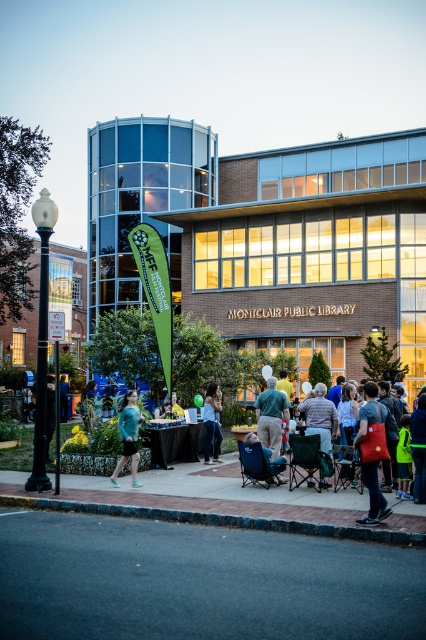
You are organizing a community event at the Monclair Public Library and need to place a decorative item on the table. Which object should you avoid placing on the black tablecloth at center to ensure it doesn not block the view of the blue fabric chair at center?

Since the black tablecloth at center is to the left of the blue fabric chair at center, placing a decorative item on the left side of the black tablecloth at center could block the view of the blue fabric chair at center. Therefore, avoid placing the decorative item on the left side of the black tablecloth at center.

You are attending an event at the Monclair Public Library and notice a teal fabric shirt at center and a blue fabric chair at center. From the perspective of someone standing at the entrance of the library, which object is located to the left?

The teal fabric shirt at center is positioned to the left of the blue fabric chair at center, so from the entrance perspective, the teal fabric shirt at center is on the left side.